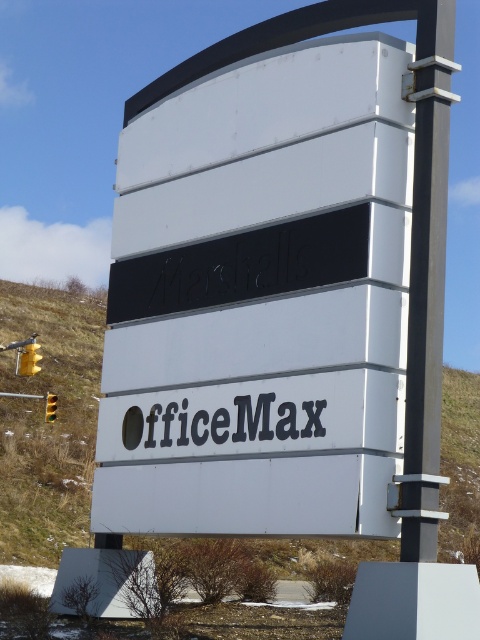
Question: Is grassy hillside at lower left behind black metal pole at upper center?

Choices:
 (A) no
 (B) yes

Answer: (B)

Question: Considering the relative positions of grassy hillside at lower left and black metal pole at upper center in the image provided, where is grassy hillside at lower left located with respect to black metal pole at upper center?

Choices:
 (A) above
 (B) below

Answer: (B)

Question: Which object is closer to the camera taking this photo?

Choices:
 (A) black metal pole at upper center
 (B) grassy hillside at lower left

Answer: (A)

Question: Where is grassy hillside at lower left located in relation to black metal pole at upper center in the image?

Choices:
 (A) below
 (B) above

Answer: (A)